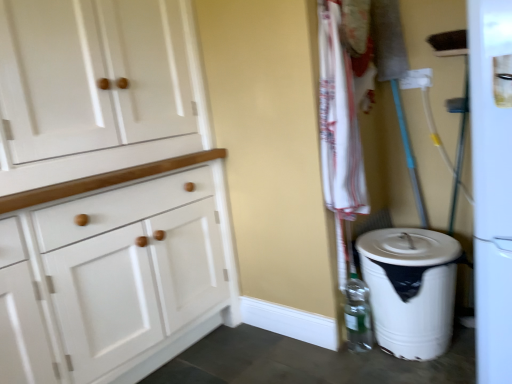
What do you see at coordinates (106, 192) in the screenshot? The width and height of the screenshot is (512, 384). I see `white wood cabinet at left` at bounding box center [106, 192].

Measure the distance between point (x=351, y=286) and camera.

Point (x=351, y=286) and camera are 6.18 feet apart.

You are a GUI agent. You are given a task and a screenshot of the screen. Output one action in this format:
    pyautogui.click(x=<x>, y=<y>)
    Task: Click on the white plastic trash can at lower right
    This screenshot has width=512, height=384.
    Given the screenshot: What is the action you would take?
    pyautogui.click(x=411, y=289)

Identify the location of white cotton towel at center-right. (339, 121).

Locate an element on the screen. laundry behind the white wood cabinet at left is located at coordinates (339, 121).

Between point (349, 160) and point (143, 204), which one is positioned in front?

The point (349, 160) is in front.

Can you see white cotton towel at center-right touching white wood cabinet at left?

white cotton towel at center-right is not next to white wood cabinet at left, and they're not touching.

From a real-world perspective, is white cotton towel at center-right positioned above or below white wood cabinet at left?

white cotton towel at center-right is above white wood cabinet at left.

Which of these two, white plastic trash can at lower right or clear plastic bottle at lower right, is thinner?

clear plastic bottle at lower right.

Can you confirm if white plastic trash can at lower right is bigger than clear plastic bottle at lower right?

Yes.

Is the depth of white plastic trash can at lower right greater than that of clear plastic bottle at lower right?

No, white plastic trash can at lower right is closer to the viewer.

Consider the image. Is white cotton towel at center-right looking in the opposite direction of white plastic trash can at lower right?

That's not correct — white cotton towel at center-right is not looking away from white plastic trash can at lower right.

From a real-world perspective, is white cotton towel at center-right on white plastic trash can at lower right?

Correct, in the physical world, white cotton towel at center-right is higher than white plastic trash can at lower right.

Does white cotton towel at center-right have a lesser width compared to white plastic trash can at lower right?

Indeed, white cotton towel at center-right has a lesser width compared to white plastic trash can at lower right.

Which is nearer, (342, 60) or (407, 287)?

Point (342, 60) is positioned closer to the camera compared to point (407, 287).

I want to click on cabinetry on the left of white plastic trash can at lower right, so click(106, 192).

Considering the positions of objects white plastic trash can at lower right and white wood cabinet at left in the image provided, who is behind, white plastic trash can at lower right or white wood cabinet at left?

white plastic trash can at lower right is further away from the camera.

Looking at this image, is white plastic trash can at lower right wider or thinner than white wood cabinet at left?

Considering their sizes, white plastic trash can at lower right looks broader than white wood cabinet at left.

Is white plastic trash can at lower right positioned beyond the bounds of white wood cabinet at left?

Yes, white plastic trash can at lower right is not within white wood cabinet at left.

Based on their positions, is white wood cabinet at left located to the left or right of clear plastic bottle at lower right?

From the image, it's evident that white wood cabinet at left is to the left of clear plastic bottle at lower right.

From a real-world perspective, is white wood cabinet at left above or below clear plastic bottle at lower right?

white wood cabinet at left is situated higher than clear plastic bottle at lower right in the real world.

From the picture: Are white wood cabinet at left and clear plastic bottle at lower right beside each other?

white wood cabinet at left and clear plastic bottle at lower right are clearly separated.

Is white wood cabinet at left oriented away from clear plastic bottle at lower right?

No.

Considering the points (350, 284) and (93, 183), which point is behind, point (350, 284) or point (93, 183)?

Point (350, 284)

Consider the image. From a real-world perspective, is clear plastic bottle at lower right on top of white wood cabinet at left?

Actually, clear plastic bottle at lower right is physically below white wood cabinet at left in the real world.

Considering their positions, is clear plastic bottle at lower right located in front of or behind white wood cabinet at left?

Clearly, clear plastic bottle at lower right is behind white wood cabinet at left.

Is clear plastic bottle at lower right taller than white wood cabinet at left?

No.

Relative to white plastic trash can at lower right, is white wood cabinet at left in front or behind?

white wood cabinet at left is positioned closer to the viewer than white plastic trash can at lower right.

Is point (184, 348) positioned behind point (392, 266)?

Yes, point (184, 348) is behind point (392, 266).

Does white wood cabinet at left contain white plastic trash can at lower right?

That's incorrect, white plastic trash can at lower right is not inside white wood cabinet at left.

Identify the location of laundry behind the white wood cabinet at left. This screenshot has width=512, height=384. (339, 121).

Find the location of a particular element. bottle beneath the white plastic trash can at lower right (from a real-world perspective) is located at coordinates (357, 315).

Which object lies nearer to the anchor point white wood cabinet at left, white plastic trash can at lower right or white cotton towel at center-right?

Based on the image, white cotton towel at center-right appears to be nearer to white wood cabinet at left.

Based on their spatial positions, is clear plastic bottle at lower right or white wood cabinet at left closer to white cotton towel at center-right?

Based on the image, clear plastic bottle at lower right appears to be nearer to white cotton towel at center-right.

Looking at this image, when comparing their distances from white wood cabinet at left, does white cotton towel at center-right or clear plastic bottle at lower right seem further?

clear plastic bottle at lower right.

Estimate the real-world distances between objects in this image. Which object is further from white cotton towel at center-right, clear plastic bottle at lower right or white plastic trash can at lower right?

clear plastic bottle at lower right is positioned further to the anchor white cotton towel at center-right.

In the scene shown: Based on their spatial positions, is white plastic trash can at lower right or clear plastic bottle at lower right further from white wood cabinet at left?

clear plastic bottle at lower right.

When comparing their distances from white plastic trash can at lower right, does clear plastic bottle at lower right or white wood cabinet at left seem closer?

Based on the image, clear plastic bottle at lower right appears to be nearer to white plastic trash can at lower right.

Considering their positions, is white wood cabinet at left positioned further to clear plastic bottle at lower right than white plastic trash can at lower right?

white wood cabinet at left is further to clear plastic bottle at lower right.

Based on their spatial positions, is white wood cabinet at left or white cotton towel at center-right further from clear plastic bottle at lower right?

The object further to clear plastic bottle at lower right is white wood cabinet at left.

Image resolution: width=512 pixels, height=384 pixels. In order to click on waste container that lies between white cotton towel at center-right and clear plastic bottle at lower right from top to bottom in this screenshot , I will do `click(411, 289)`.

Find the location of `laundry between white wood cabinet at left and white plastic trash can at lower right from left to right`. laundry between white wood cabinet at left and white plastic trash can at lower right from left to right is located at coordinates (339, 121).

At what (x,y) coordinates should I click in order to perform the action: click on bottle situated between white wood cabinet at left and white plastic trash can at lower right from left to right. Please return your answer as a coordinate pair (x, y). Looking at the image, I should click on (357, 315).

This screenshot has width=512, height=384. I want to click on laundry between white wood cabinet at left and clear plastic bottle at lower right from left to right, so click(339, 121).